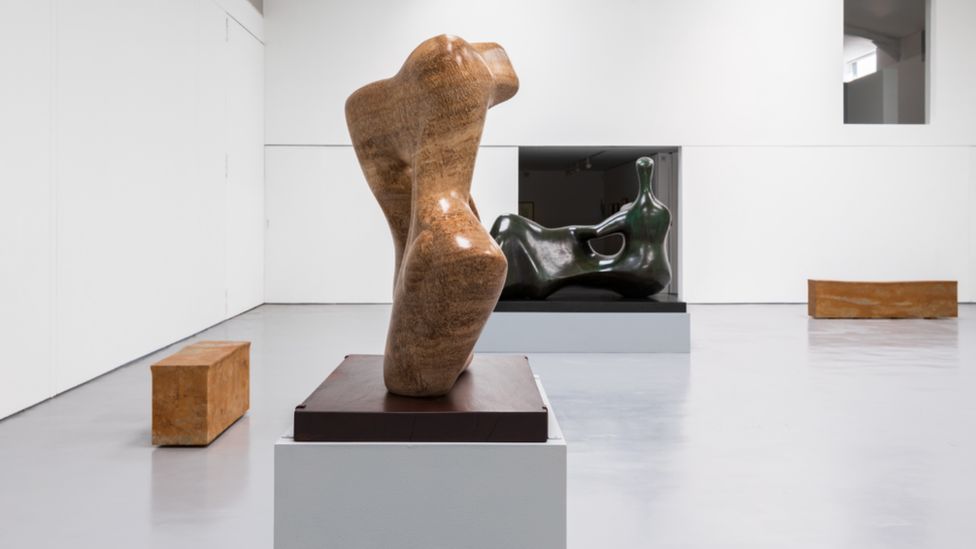
At what (x,y) coordinates should I click in order to perform the action: click on sculptures. Please return your answer as a coordinate pair (x, y). This screenshot has width=976, height=549. Looking at the image, I should click on (441, 151), (631, 237).